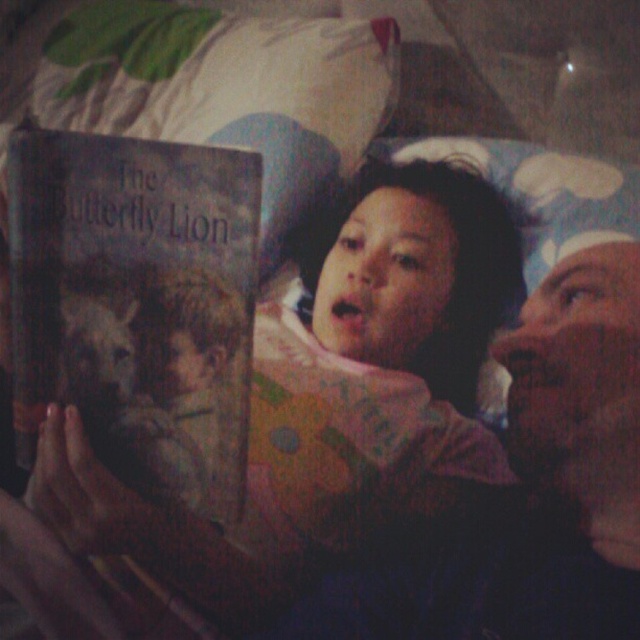
How much distance is there between white fabric pillow at upper center and fluffy white pillow at upper center?

8.32 inches

Is point (266, 268) less distant than point (525, 282)?

No, it is behind (525, 282).

What do you see at coordinates (225, 88) in the screenshot?
I see `white fabric pillow at upper center` at bounding box center [225, 88].

Find the location of `white fabric pillow at upper center`. white fabric pillow at upper center is located at coordinates (225, 88).

Looking at this image, can you confirm if hardcover book at center is wider than white fabric pillow at upper center?

In fact, hardcover book at center might be narrower than white fabric pillow at upper center.

Is hardcover book at center above white fabric pillow at upper center?

Incorrect, hardcover book at center is not positioned above white fabric pillow at upper center.

Who is more forward, (51,173) or (291,102)?

Point (51,173) is in front.

You are a GUI agent. You are given a task and a screenshot of the screen. Output one action in this format:
    pyautogui.click(x=<x>, y=<y>)
    Task: Click on the hardcover book at center
    This screenshot has width=640, height=640.
    Given the screenshot: What is the action you would take?
    pyautogui.click(x=138, y=305)

How far apart are hardcover book at center and fluffy white pillow at upper center?

13.50 inches

Consider the image. Does hardcover book at center have a smaller size compared to fluffy white pillow at upper center?

Indeed, hardcover book at center has a smaller size compared to fluffy white pillow at upper center.

Is point (192, 321) less distant than point (518, 189)?

That is True.

Identify the location of hardcover book at center. (138, 305).